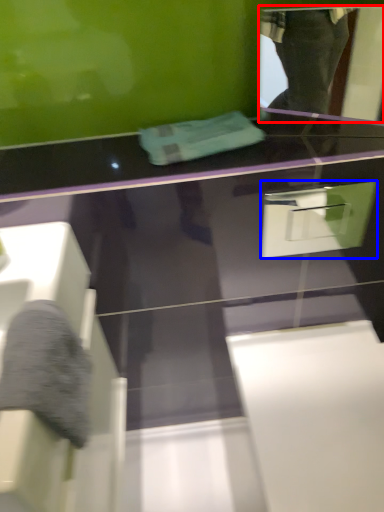
Question: Among these objects, which one is farthest to the camera, mirror (highlighted by a red box) or drawer (highlighted by a blue box)?

Choices:
 (A) mirror
 (B) drawer

Answer: (B)